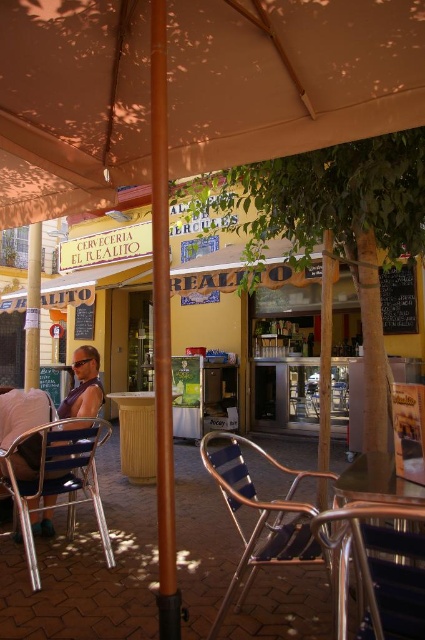
You are a visitor at Cerveceria El Realito and want to sit on the metallic blue chair at lower center. However, you need to walk past the brown wooden pole at center to reach it. Can you walk under the pole without bending down?

The metallic blue chair at lower center is shorter than the brown wooden pole at center. Since the pole is taller than the chair, the pole is likely tall enough for you to walk under without bending down.

You are a customer sitting at the outdoor area of Cerveceria El Realito. You notice two poles supporting the canopy. Which pole is closer to you, the brown polished pole at center or the metallic pole at left?

The brown polished pole at center is closer to you because it is in front of the metallic pole at left.

You are a customer at Cerveceria El Realito and want to choose a seat that is narrower between the metallic blue chair at lower center and the brown wooden pole at center. Which one should you pick?

The metallic blue chair at lower center is thinner than the brown wooden pole at center, so you should pick the metallic blue chair at lower center as it is narrower.